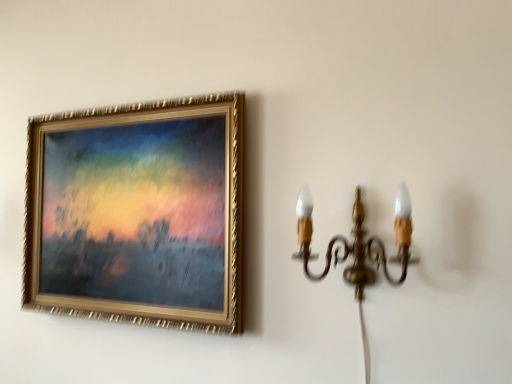
Question: Is gold-framed painting at upper left taller or shorter than gold brass wall sconce at right?

Choices:
 (A) short
 (B) tall

Answer: (B)

Question: Is point (240, 215) positioned closer to the camera than point (369, 382)?

Choices:
 (A) closer
 (B) farther

Answer: (B)

Question: Looking at their shapes, would you say gold-framed painting at upper left is wider or thinner than gold brass wall sconce at right?

Choices:
 (A) wide
 (B) thin

Answer: (B)

Question: Is point (368, 377) closer or farther from the camera than point (156, 170)?

Choices:
 (A) farther
 (B) closer

Answer: (B)

Question: Is gold brass wall sconce at right taller or shorter than gold-framed painting at upper left?

Choices:
 (A) tall
 (B) short

Answer: (B)

Question: Is gold brass wall sconce at right in front of or behind gold-framed painting at upper left in the image?

Choices:
 (A) behind
 (B) front

Answer: (B)

Question: Looking at the image, does gold brass wall sconce at right seem bigger or smaller compared to gold-framed painting at upper left?

Choices:
 (A) big
 (B) small

Answer: (B)